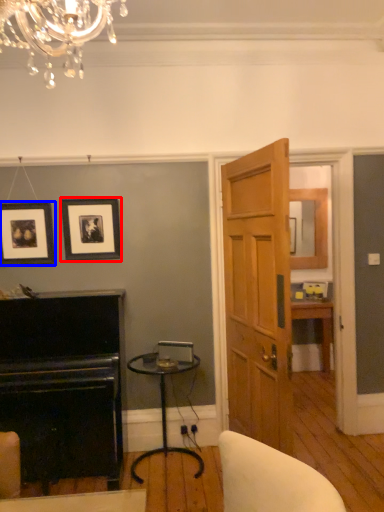
Question: Which object is further to the camera taking this photo, picture frame (highlighted by a red box) or picture frame (highlighted by a blue box)?

Choices:
 (A) picture frame
 (B) picture frame

Answer: (A)